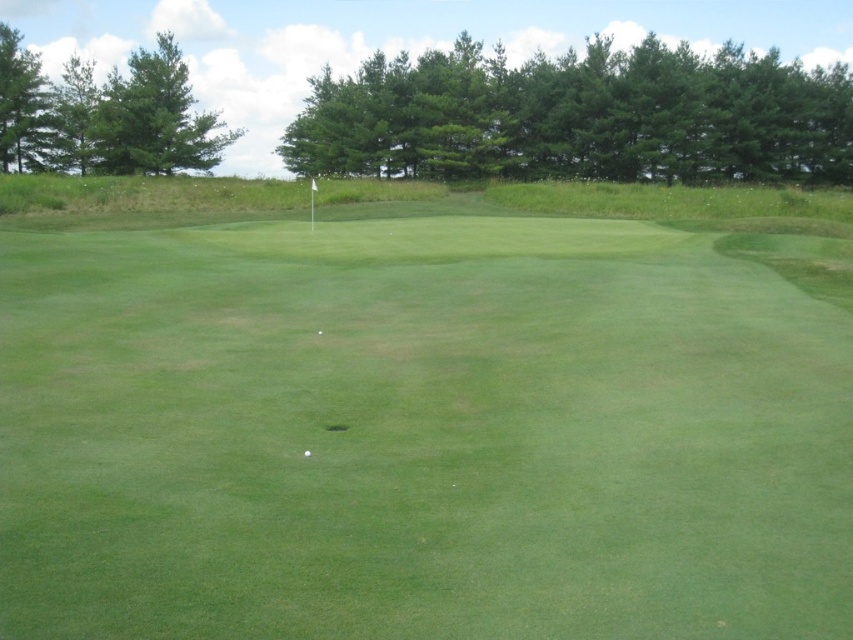
You are a golfer trying to determine the best path for your ball to reach the hole. Considering the green grassy putting green at center and the white smooth golf ball at center, which object is wider?

The green grassy putting green at center is wider than the white smooth golf ball at center according to the description.

You are a golfer standing at the point labeled point (408, 582) and want to putt the ball into the hole located at point (310, 454). Considering the slope of the green, which direction should you aim to ensure the ball rolls towards the hole?

Since point (408, 582) is in front of point (310, 454), you should aim to putt the ball in a direction away from yourself towards the hole located at point (310, 454). This ensures the ball rolls backward towards the hole, taking advantage of the slope.